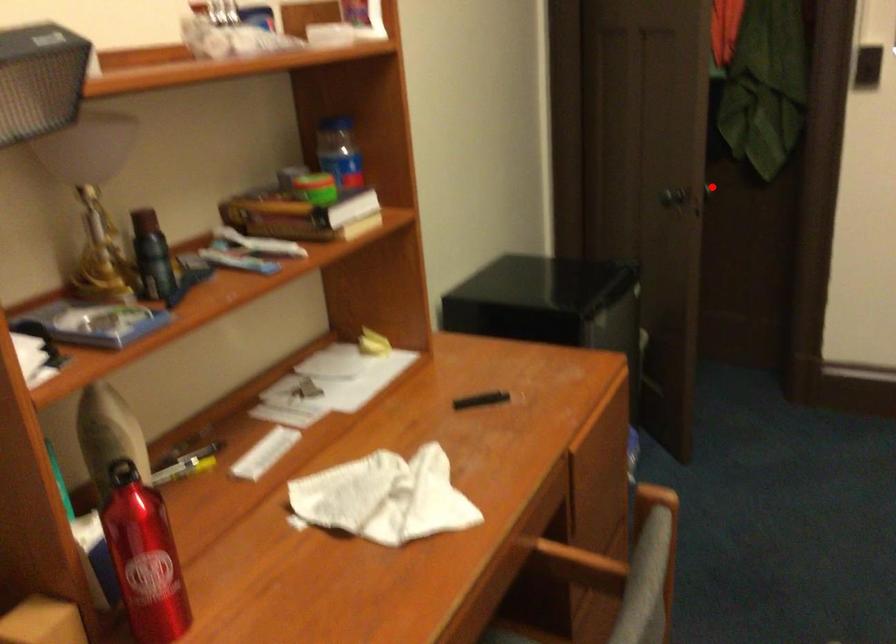
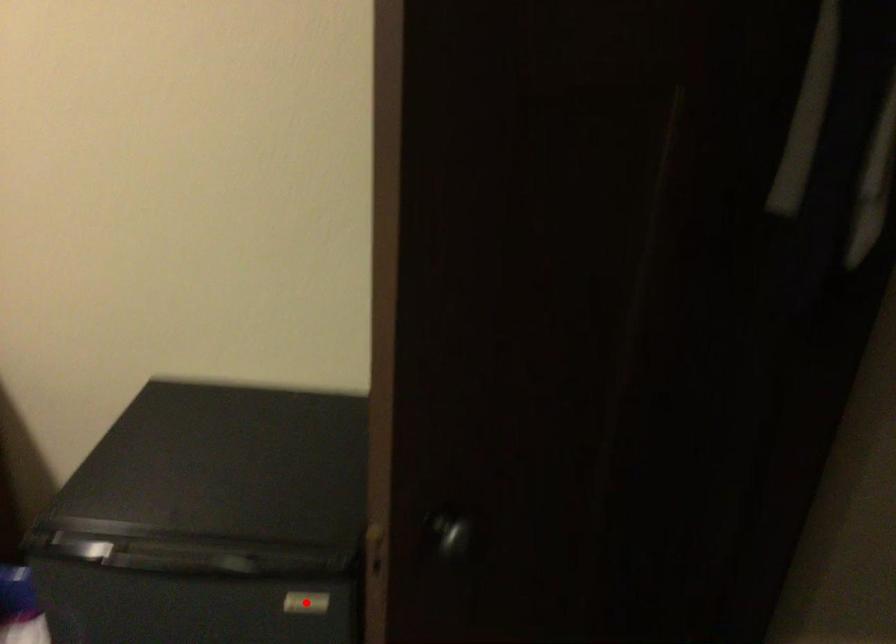
I am providing you with two images of the same scene from different viewpoints. A red point is marked on the first image and another point is marked on the second image. Do the highlighted points in image1 and image2 indicate the same real-world spot?

No